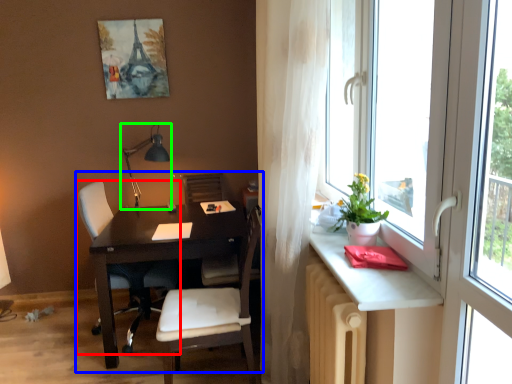
Question: Based on their relative distances, which object is nearer to chair (highlighted by a red box)? Choose from computer desk (highlighted by a blue box) and table lamp (highlighted by a green box).

Choices:
 (A) computer desk
 (B) table lamp

Answer: (A)